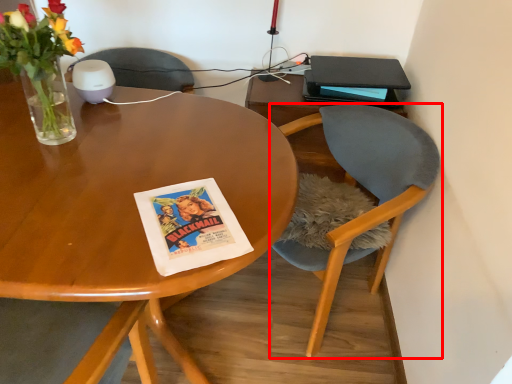
Question: From the image, what is the correct spatial relationship of chair (annotated by the red box) in relation to paperback book?

Choices:
 (A) right
 (B) left

Answer: (B)